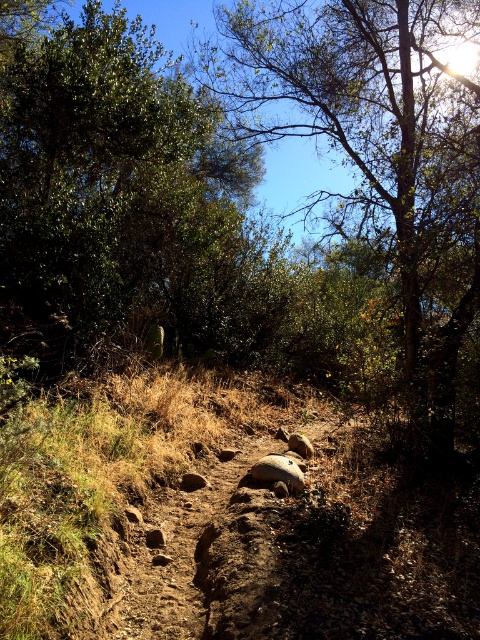
Between green leafy tree at upper left and green leafy tree at center, which one has less height?

With less height is green leafy tree at upper left.

Can you confirm if green leafy tree at upper left is positioned to the left of green leafy tree at center?

Yes, green leafy tree at upper left is to the left of green leafy tree at center.

The image size is (480, 640). In order to click on green leafy tree at upper left in this screenshot , I will do `click(118, 186)`.